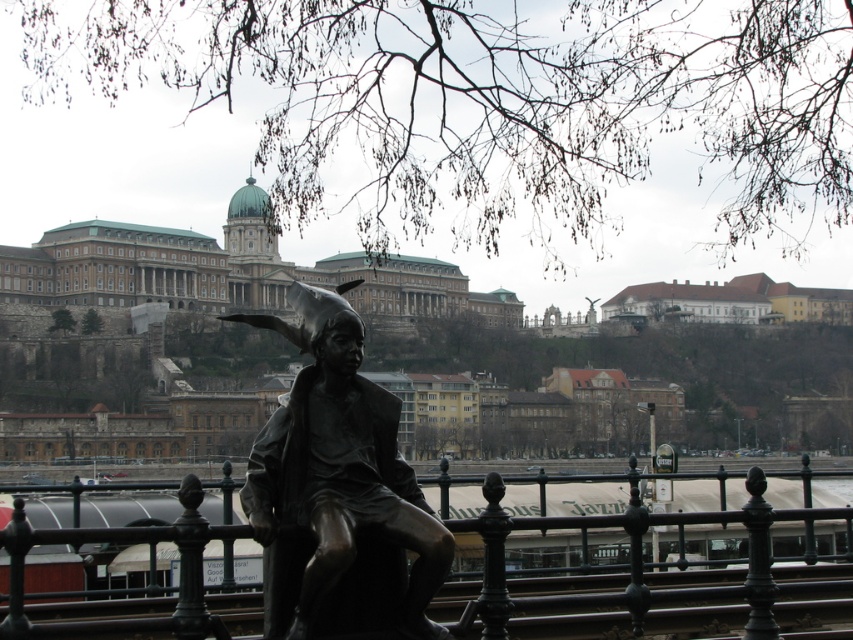
Question: Among these objects, which one is nearest to the camera?

Choices:
 (A) bronze metal rail at center
 (B) bronze statue at center

Answer: (A)

Question: Which object is closer to the camera taking this photo?

Choices:
 (A) bronze statue at center
 (B) brown stone palace at upper center
 (C) bronze metal rail at center

Answer: (C)

Question: Is brown stone palace at upper center positioned in front of bronze metal rail at center?

Choices:
 (A) yes
 (B) no

Answer: (B)

Question: Among these points, which one is nearest to the camera?

Choices:
 (A) (268, 236)
 (B) (379, 504)

Answer: (B)

Question: Is the position of bronze statue at center less distant than that of bronze metal rail at center?

Choices:
 (A) yes
 (B) no

Answer: (B)

Question: Does bronze statue at center appear on the right side of brown stone palace at upper center?

Choices:
 (A) no
 (B) yes

Answer: (B)